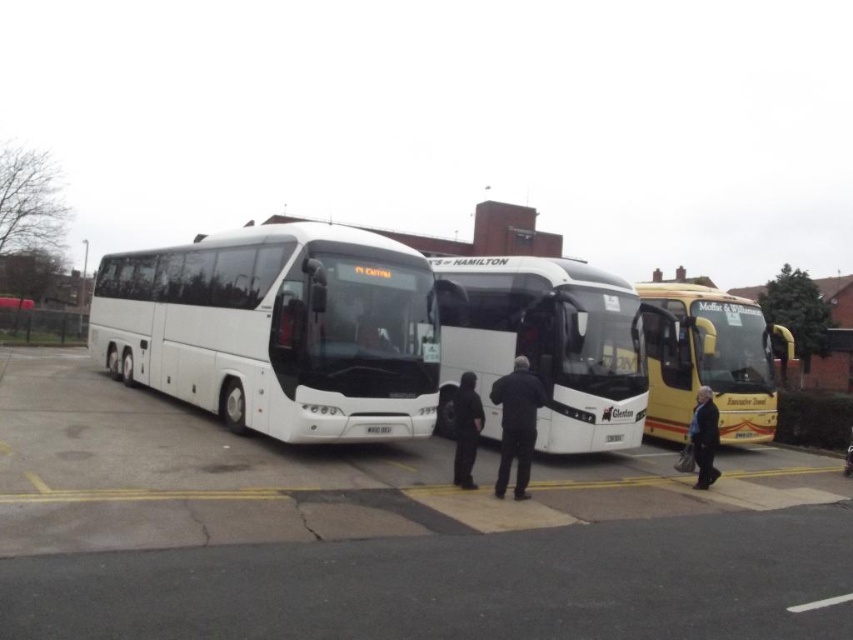
Question: Can you confirm if white glossy bus at left is smaller than black matte jacket at center?

Choices:
 (A) yes
 (B) no

Answer: (B)

Question: Can you confirm if black matte jacket at center is bigger than dark blue jacket at lower right?

Choices:
 (A) yes
 (B) no

Answer: (B)

Question: Which of the following is the farthest from the observer?

Choices:
 (A) white glossy bus at center
 (B) white glossy bus at left
 (C) yellow matte bus at right
 (D) dark blue jacket at lower right

Answer: (C)

Question: Which object appears farthest from the camera in this image?

Choices:
 (A) white glossy bus at left
 (B) dark blue jacket at lower right

Answer: (B)

Question: Is white glossy coach at center behind black matte jacket at center?

Choices:
 (A) no
 (B) yes

Answer: (B)

Question: Which object is positioned closest to the black matte jacket at center?

Choices:
 (A) yellow matte bus at right
 (B) white glossy bus at center

Answer: (B)